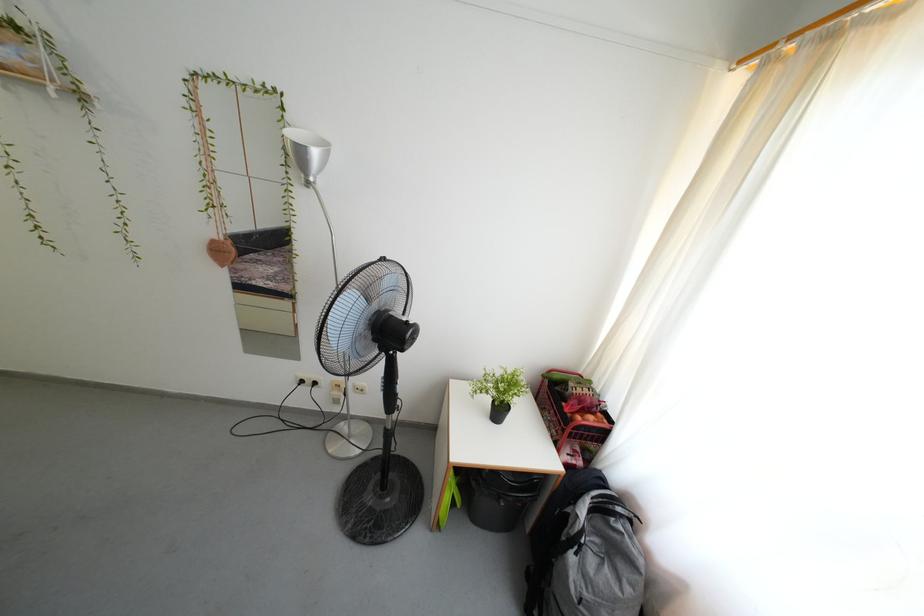
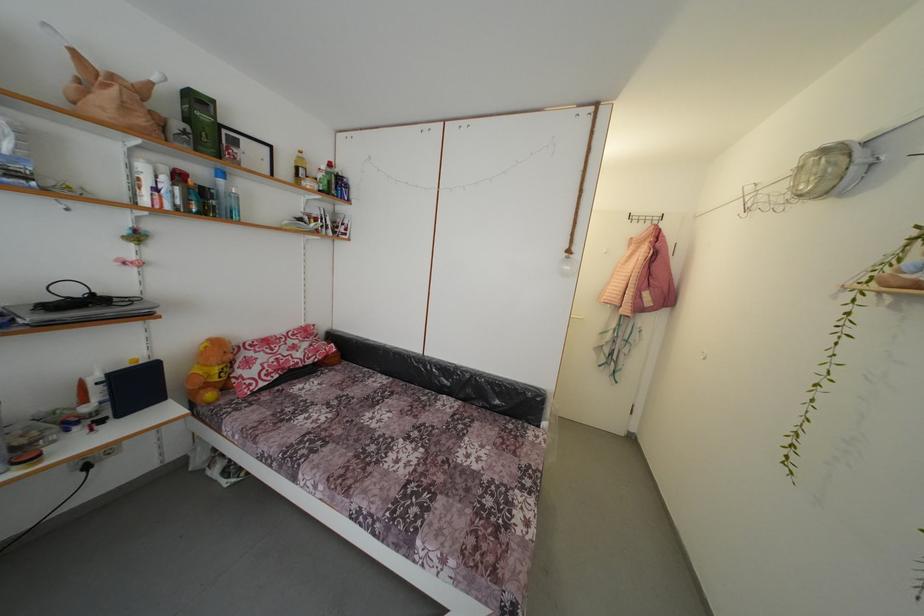
Question: The images are taken continuously from a first-person perspective. In which direction is your viewpoint rotating?

Choices:
 (A) Left
 (B) Right
 (C) Up
 (D) Down

Answer: (A)